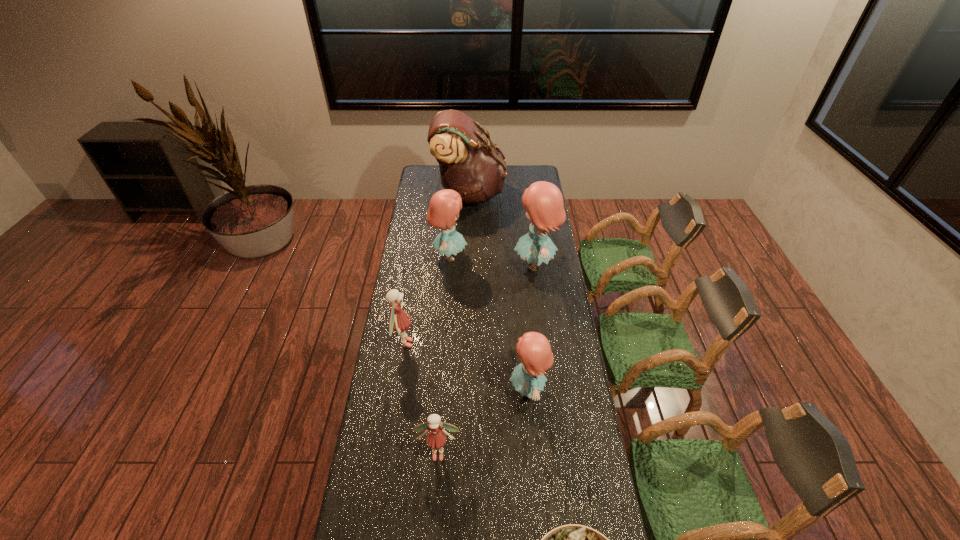
At what (x,y) coordinates should I click in order to perform the action: click on satchel. Please return your answer as a coordinate pair (x, y). Looking at the image, I should click on (469, 164).

Image resolution: width=960 pixels, height=540 pixels. In order to click on the biggest blue doll in this screenshot , I will do `click(543, 201)`.

Image resolution: width=960 pixels, height=540 pixels. Identify the location of the leftmost blue doll. (444, 207).

Locate an element on the screen. The image size is (960, 540). the second smallest blue doll is located at coordinates (444, 207).

Identify the location of the farther pink doll. (399, 321).

The image size is (960, 540). Find the location of `the left pink doll`. the left pink doll is located at coordinates (399, 321).

The width and height of the screenshot is (960, 540). I want to click on the smallest blue doll, so click(x=534, y=351).

Where is `the nearer pink doll`? This screenshot has width=960, height=540. the nearer pink doll is located at coordinates (436, 438).

Image resolution: width=960 pixels, height=540 pixels. Identify the location of the right pink doll. (436, 438).

Where is `vacant area located 0.200m at the front of the satchel with buckles`? vacant area located 0.200m at the front of the satchel with buckles is located at coordinates (x=540, y=193).